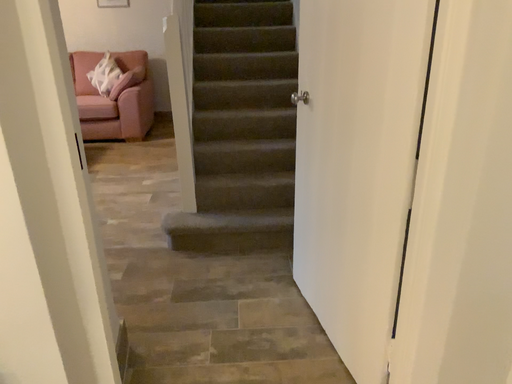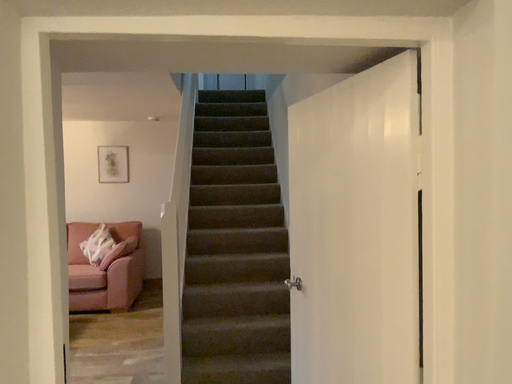
Question: How did the camera likely rotate when shooting the video?

Choices:
 (A) rotated downward
 (B) rotated upward

Answer: (B)